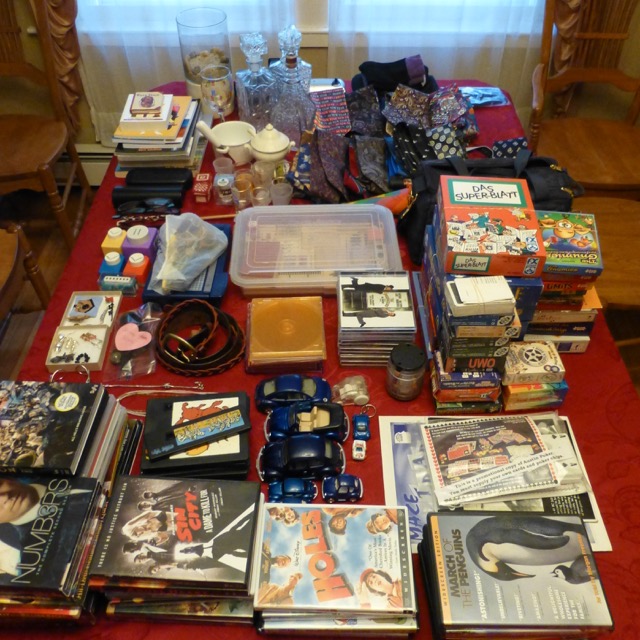
The width and height of the screenshot is (640, 640). In order to click on toy cars in this screenshot , I will do `click(290, 463)`, `click(294, 483)`, `click(335, 484)`, `click(291, 419)`, `click(288, 390)`, `click(358, 429)`, `click(361, 438)`.